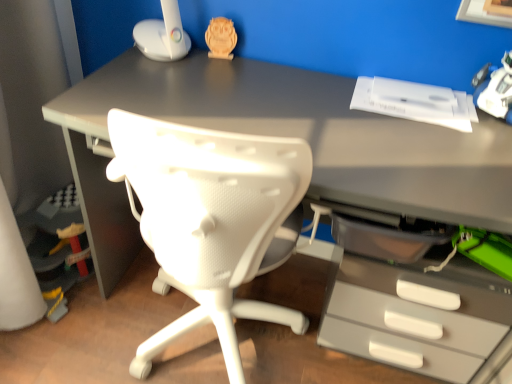
Question: Does wooden owl at upper center, positioned as the 2th toy in front-to-back order, have a greater height compared to white plastic toy at upper right, the second toy in the back-to-front sequence?

Choices:
 (A) yes
 (B) no

Answer: (B)

Question: Considering the relative positions of wooden owl at upper center, which is the 1th toy from top to bottom, and white plastic toy at upper right, positioned as the 1th toy in bottom-to-top order, in the image provided, is wooden owl at upper center, which is the 1th toy from top to bottom, behind white plastic toy at upper right, positioned as the 1th toy in bottom-to-top order,?

Choices:
 (A) yes
 (B) no

Answer: (A)

Question: Is wooden owl at upper center, which is the 1th toy from back to front, positioned in front of white plastic toy at upper right, the second toy in the back-to-front sequence?

Choices:
 (A) yes
 (B) no

Answer: (B)

Question: Can you confirm if wooden owl at upper center, marked as the second toy in a bottom-to-top arrangement, is shorter than white plastic toy at upper right, the second toy in the back-to-front sequence?

Choices:
 (A) yes
 (B) no

Answer: (A)

Question: Are wooden owl at upper center, positioned as the 2th toy in front-to-back order, and white plastic toy at upper right, which is counted as the second toy, starting from the top, beside each other?

Choices:
 (A) yes
 (B) no

Answer: (B)

Question: From a real-world perspective, is wooden owl at upper center, positioned as the 2th toy in front-to-back order, under white plastic toy at upper right, which is counted as the second toy, starting from the top?

Choices:
 (A) yes
 (B) no

Answer: (A)

Question: From the image's perspective, would you say white plastic toy at upper right, which is counted as the second toy, starting from the top, is positioned over wooden owl at upper center, positioned as the 2th toy in front-to-back order?

Choices:
 (A) no
 (B) yes

Answer: (A)

Question: Is white plastic toy at upper right, the 1th toy when ordered from front to back, completely or partially outside of wooden owl at upper center, positioned as the 1th toy in left-to-right order?

Choices:
 (A) yes
 (B) no

Answer: (A)

Question: Is the depth of white plastic toy at upper right, the 1th toy when ordered from right to left, less than that of wooden owl at upper center, which is counted as the second toy, starting from the right?

Choices:
 (A) yes
 (B) no

Answer: (A)

Question: Is white plastic toy at upper right, the 1th toy when ordered from front to back, thinner than wooden owl at upper center, which is the 1th toy from back to front?

Choices:
 (A) yes
 (B) no

Answer: (B)

Question: Does white plastic toy at upper right, acting as the second toy starting from the left, have a greater height compared to wooden owl at upper center, which is counted as the second toy, starting from the right?

Choices:
 (A) yes
 (B) no

Answer: (A)

Question: Is white plastic toy at upper right, the 1th toy when ordered from right to left, next to wooden owl at upper center, positioned as the 2th toy in front-to-back order?

Choices:
 (A) yes
 (B) no

Answer: (B)

Question: Considering the positions of wooden owl at upper center, which is the 1th toy from back to front, and white plastic toy at upper right, which is counted as the second toy, starting from the top, in the image, is wooden owl at upper center, which is the 1th toy from back to front, wider or thinner than white plastic toy at upper right, which is counted as the second toy, starting from the top,?

Choices:
 (A) thin
 (B) wide

Answer: (A)